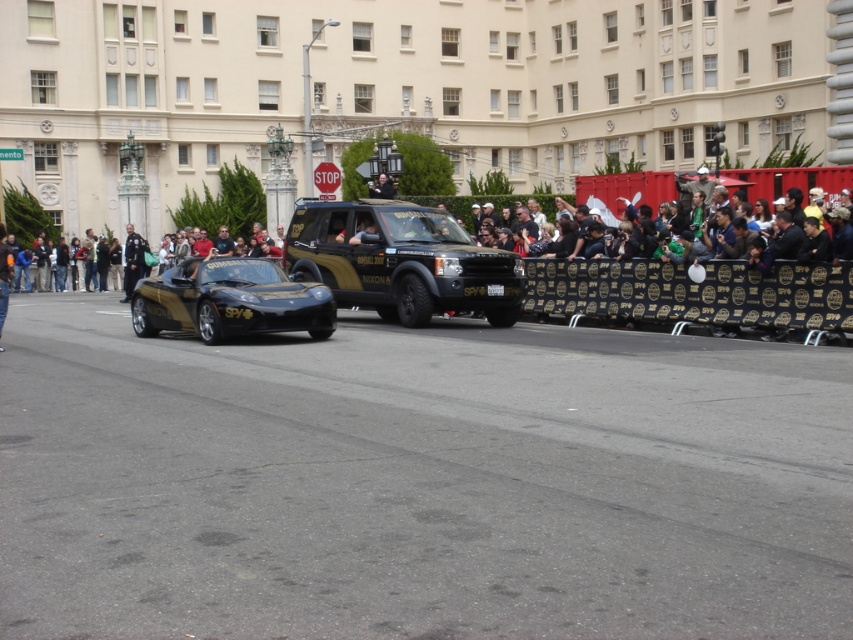
You are a photographer trying to capture both the gold metallic sports car at center and the gold metallic helmet at center in a single shot. Since you want the car to appear on the left side of the photo, is the current arrangement suitable?

Yes, the current arrangement is suitable because the gold metallic sports car at center is already positioned to the left of the gold metallic helmet at center, which aligns with your requirement.

You are a photographer standing in the middle of the street. You want to take a photo of both the gold metallic sports car at center and the black leather jacket at center. Which object should you adjust your camera to focus on first if you want to capture both in the same frame without moving your position?

The gold metallic sports car at center is positioned on the right side of the black leather jacket at center. To capture both in the same frame without moving, focus on the black leather jacket at center first as it is closer to the center, allowing the camera to include the gold metallic sports car at center on its right side in the frame.